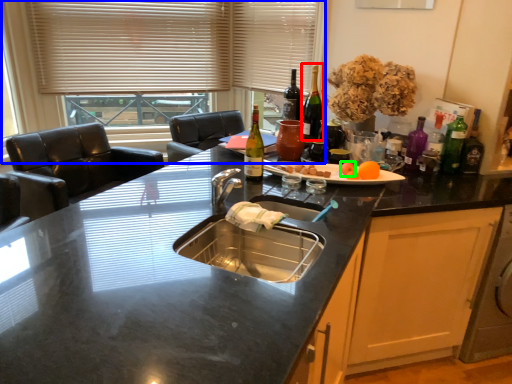
Question: Estimate the real-world distances between objects in this image. Which object is farther from wine bottle (highlighted by a red box), window (highlighted by a blue box) or food (highlighted by a green box)?

Choices:
 (A) window
 (B) food

Answer: (A)